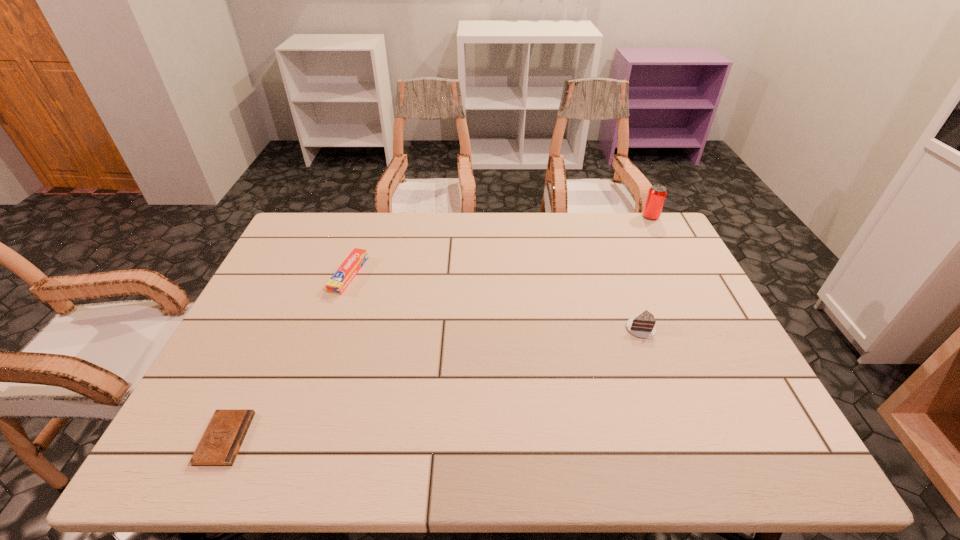
Locate an element on the screen. Image resolution: width=960 pixels, height=540 pixels. unoccupied position between the can and the third nearest object is located at coordinates (500, 246).

Find the location of a particular element. This screenshot has width=960, height=540. free space that is in between the third shortest object and the third object from right to left is located at coordinates (495, 302).

Find the location of `free area in between the can and the third object from right to left`. free area in between the can and the third object from right to left is located at coordinates click(500, 246).

Locate an element on the screen. The height and width of the screenshot is (540, 960). free spot between the second object from right to left and the diary is located at coordinates (433, 384).

What are the coordinates of `unoccupied position between the farthest object and the second nearest object` in the screenshot? It's located at (646, 273).

Where is `object that is the third nearest to the third object from left to right`? This screenshot has width=960, height=540. object that is the third nearest to the third object from left to right is located at coordinates (223, 437).

Select which object is the closest to the third shortest object. Please provide its 2D coordinates. Your answer should be formatted as a tuple, i.e. [(x, y)], where the tuple contains the x and y coordinates of a point satisfying the conditions above.

[(657, 193)]

The width and height of the screenshot is (960, 540). What are the coordinates of `vacant space that satisfies the following two spatial constraints: 1. on the front side of the second nearest object; 2. on the spine side of the shortest object` in the screenshot? It's located at (682, 438).